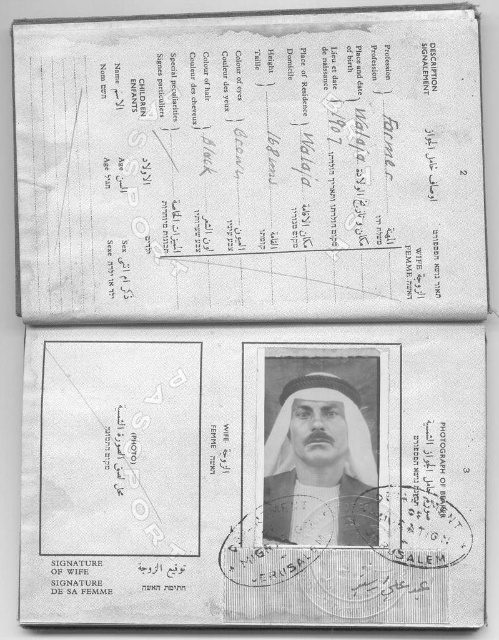
Question: Is white paper receipt at upper center below black paper at lower right?

Choices:
 (A) yes
 (B) no

Answer: (B)

Question: Among these points, which one is nearest to the camera?

Choices:
 (A) (128, 483)
 (B) (312, 481)
 (C) (19, 76)

Answer: (B)

Question: Among these objects, which one is farthest from the camera?

Choices:
 (A) black paper at lower right
 (B) white paper receipt at upper center
 (C) black matte headscarf at center

Answer: (B)

Question: Can you confirm if black paper at lower right is wider than black matte headscarf at center?

Choices:
 (A) yes
 (B) no

Answer: (A)

Question: Is black paper at lower right bigger than black matte headscarf at center?

Choices:
 (A) no
 (B) yes

Answer: (B)

Question: Which point appears farthest from the camera in this image?

Choices:
 (A) (269, 384)
 (B) (360, 525)
 (C) (78, 106)

Answer: (C)